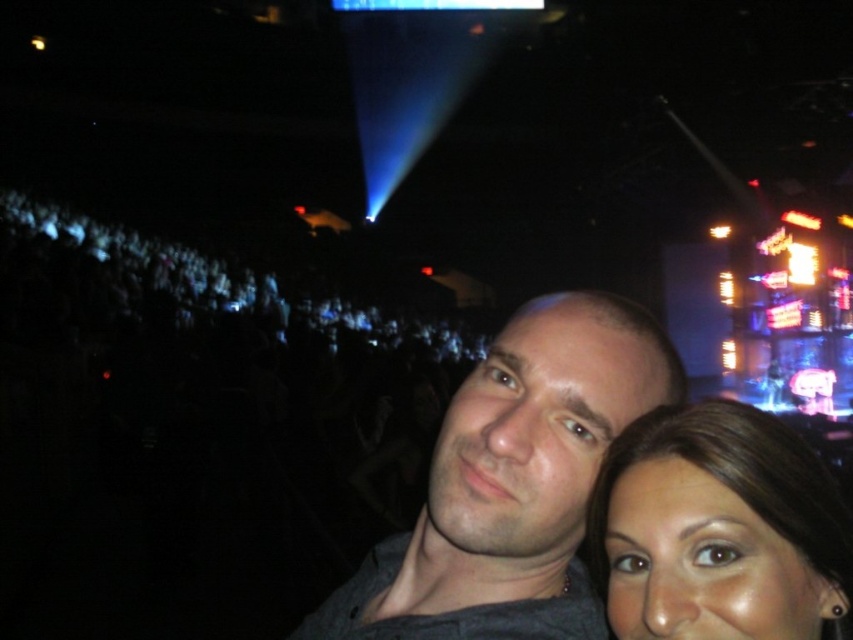
Question: Is dark gray shirt at center bigger than brown hair at lower right?

Choices:
 (A) no
 (B) yes

Answer: (B)

Question: Does dark gray shirt at center have a smaller size compared to brown hair at lower right?

Choices:
 (A) yes
 (B) no

Answer: (B)

Question: Which point appears farthest from the camera in this image?

Choices:
 (A) (740, 456)
 (B) (512, 365)

Answer: (B)

Question: Among these points, which one is nearest to the camera?

Choices:
 (A) (494, 630)
 (B) (741, 568)

Answer: (B)

Question: In this image, where is dark gray shirt at center located relative to brown hair at lower right?

Choices:
 (A) above
 (B) below

Answer: (B)